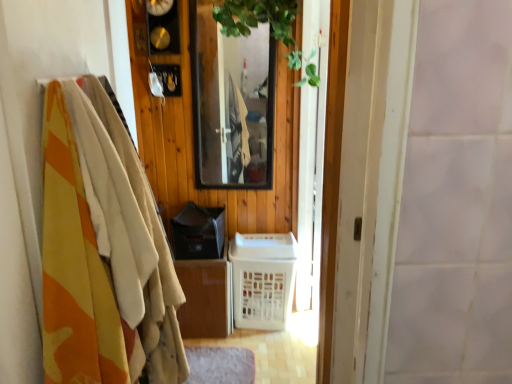
Locate an element on the screen. vacant area on top of gray soft mat at lower center (from a real-world perspective) is located at coordinates (220, 362).